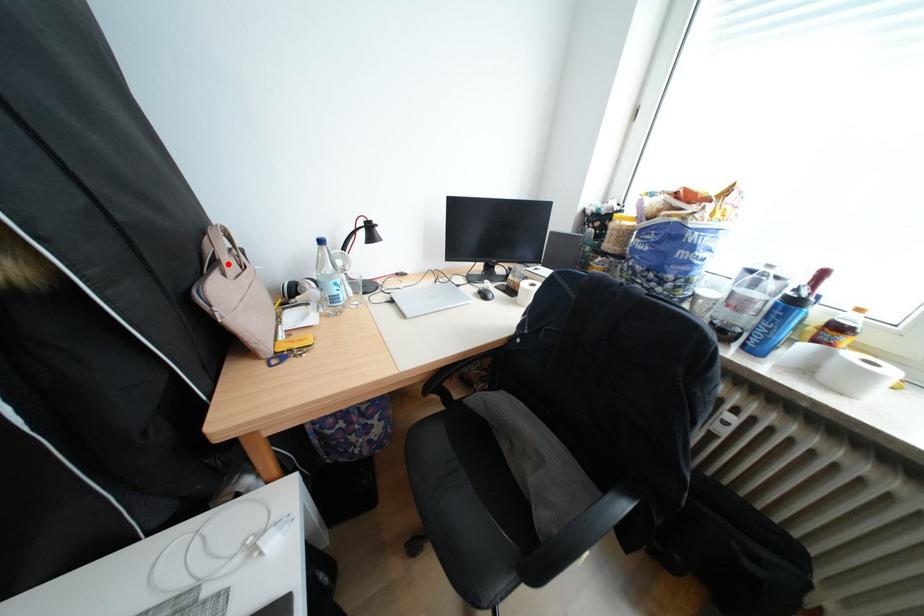
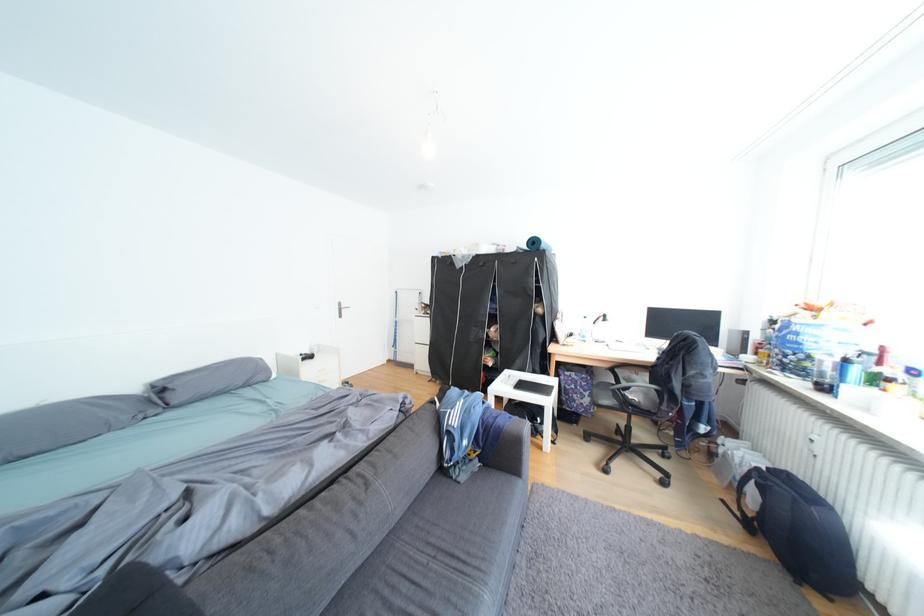
Question: I am providing you with two images of the same scene from different viewpoints. A red point is marked on the first image. Can you still see the location of the red point in image 2?

Choices:
 (A) Yes
 (B) No

Answer: (A)